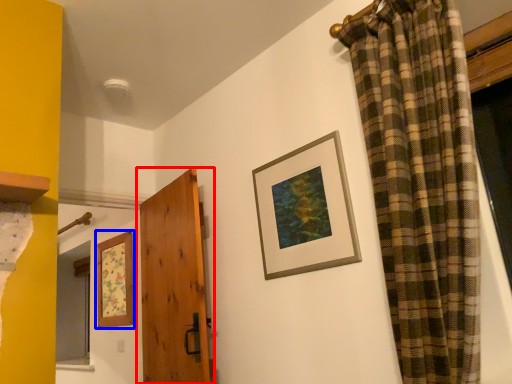
Question: Which point is closer to the camera, door (highlighted by a red box) or picture frame (highlighted by a blue box)?

Choices:
 (A) door
 (B) picture frame

Answer: (A)